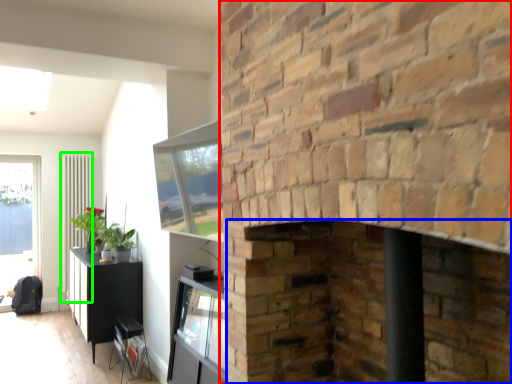
Question: Considering the real-world distances, which object is farthest from fireplace (highlighted by a red box)? fireplace (highlighted by a blue box) or radiator (highlighted by a green box)?

Choices:
 (A) fireplace
 (B) radiator

Answer: (B)